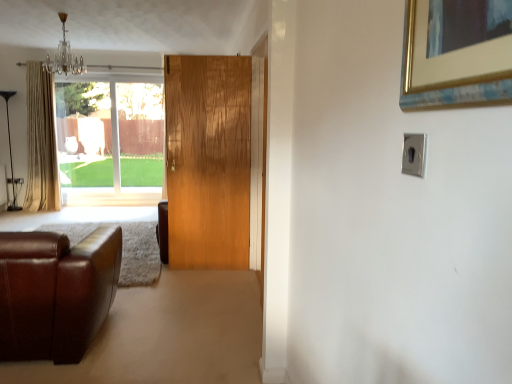
Question: Is beige fabric curtain at left taller or shorter than satin silver switch at upper right?

Choices:
 (A) tall
 (B) short

Answer: (A)

Question: Is beige fabric curtain at left situated inside satin silver switch at upper right or outside?

Choices:
 (A) inside
 (B) outside

Answer: (B)

Question: Which is nearer to the brown leather couch at lower left?

Choices:
 (A) satin silver switch at upper right
 (B) crystal glass chandelier at upper left
 (C) wooden door at center
 (D) clear glass window at upper left
 (E) beige fabric curtain at left

Answer: (C)

Question: Estimate the real-world distances between objects in this image. Which object is closer to the clear glass window at upper left?

Choices:
 (A) crystal glass chandelier at upper left
 (B) satin silver switch at upper right
 (C) brown leather couch at lower left
 (D) wooden door at center
 (E) beige fabric curtain at left

Answer: (E)